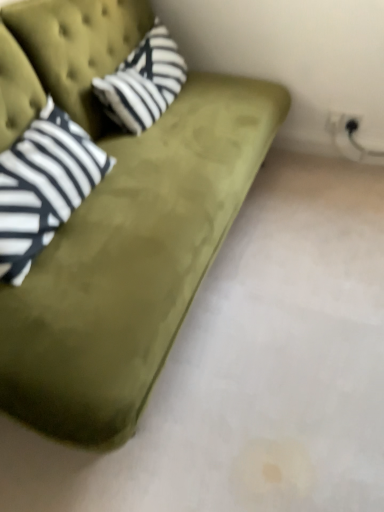
Question: From the image's perspective, is olive green velvet couch at upper left positioned above or below striped cotton pillow at upper left?

Choices:
 (A) above
 (B) below

Answer: (B)

Question: Based on their positions, is olive green velvet couch at upper left located to the left or right of striped cotton pillow at upper left?

Choices:
 (A) right
 (B) left

Answer: (B)

Question: Considering the real-world distances, which object is farthest from the striped cotton pillow at upper left?

Choices:
 (A) olive green velvet couch at upper left
 (B) striped fabric pillow at left

Answer: (B)

Question: Which of these objects is positioned farthest from the striped fabric pillow at left?

Choices:
 (A) olive green velvet couch at upper left
 (B) striped cotton pillow at upper left

Answer: (B)